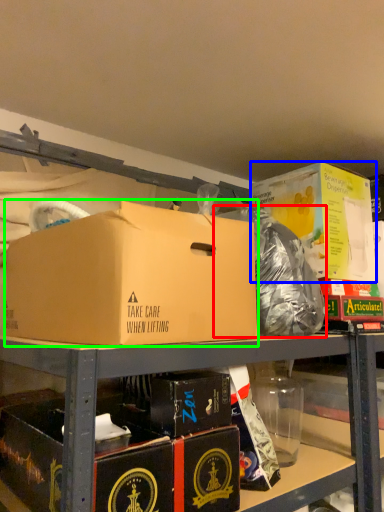
Question: Based on their relative distances, which object is farther from garbage (highlighted by a red box)? Choose from box (highlighted by a blue box) and box (highlighted by a green box).

Choices:
 (A) box
 (B) box

Answer: (B)